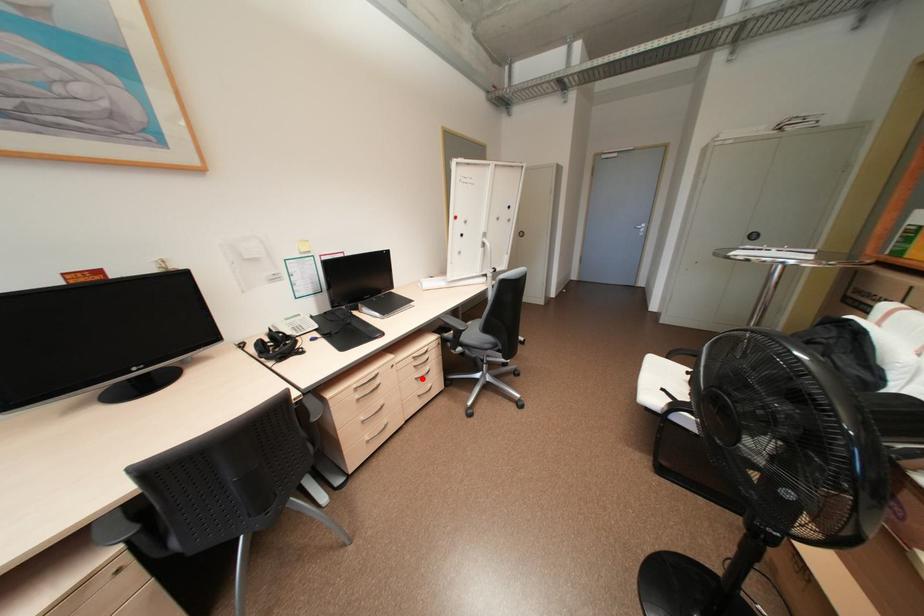
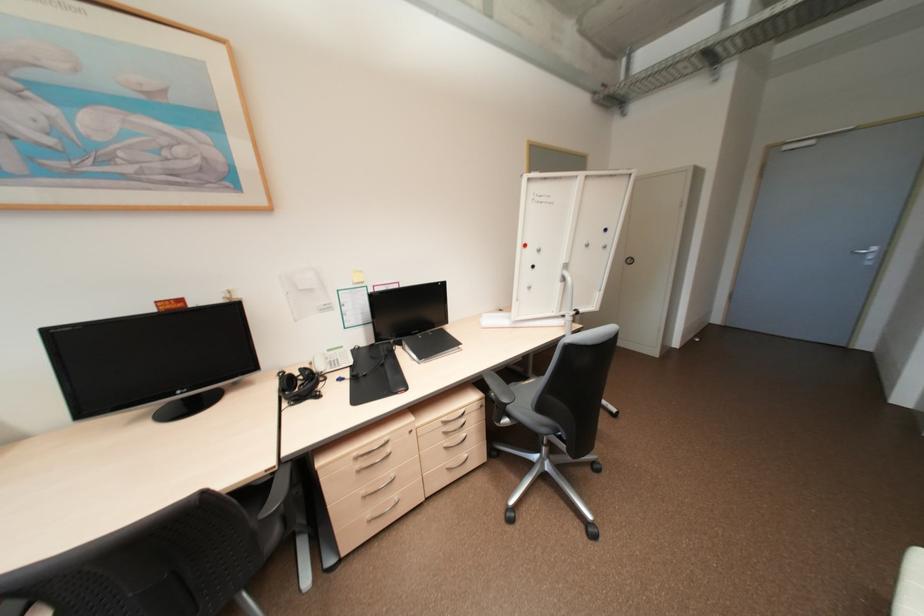
Question: I am providing you with two images of the same scene from different viewpoints. In image1, a red point is highlighted. Considering the same 3D point in image2, which of the following is correct?

Choices:
 (A) It is closer
 (B) It is farther

Answer: (B)